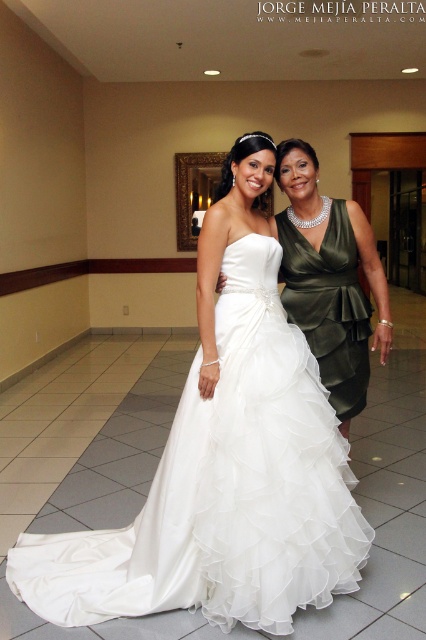
You are a photographer at a wedding venue. You need to position both the white satin dress at center and the satin green dress at right in the frame. Based on their widths, which dress should you place closer to the camera to ensure both fit in the frame without overlapping?

The white satin dress at center might be wider than the satin green dress at right, so placing the wider white satin dress at center closer to the camera will help it fit better in the frame since objects closer to the camera appear larger.

You are a photographer at a wedding venue. You need to place a bouquet at point (224,461). According to the image, what object is located at that point?

The white satin dress at center is located at point (224,461).